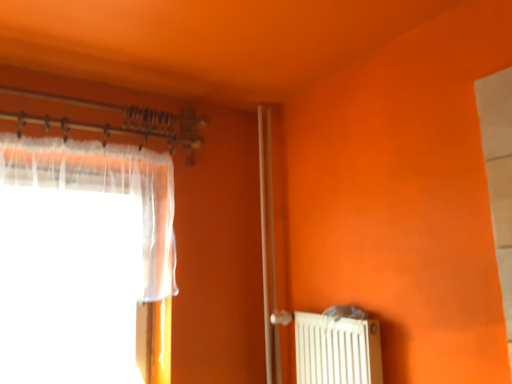
Question: Can you confirm if white matte radiator at lower right is positioned to the left of translucent fabric curtain at left?

Choices:
 (A) no
 (B) yes

Answer: (A)

Question: From a real-world perspective, is white matte radiator at lower right on top of translucent fabric curtain at left?

Choices:
 (A) yes
 (B) no

Answer: (B)

Question: From the image's perspective, does white matte radiator at lower right appear lower than translucent fabric curtain at left?

Choices:
 (A) no
 (B) yes

Answer: (B)

Question: Considering the relative positions of white matte radiator at lower right and translucent fabric curtain at left in the image provided, is white matte radiator at lower right to the right of translucent fabric curtain at left from the viewer's perspective?

Choices:
 (A) yes
 (B) no

Answer: (A)

Question: From a real-world perspective, is white matte radiator at lower right under translucent fabric curtain at left?

Choices:
 (A) no
 (B) yes

Answer: (B)

Question: Considering the relative sizes of white matte radiator at lower right and translucent fabric curtain at left in the image provided, is white matte radiator at lower right wider than translucent fabric curtain at left?

Choices:
 (A) yes
 (B) no

Answer: (B)

Question: Considering the relative positions of clear glass screen door at center and translucent fabric curtain at left in the image provided, is clear glass screen door at center to the right of translucent fabric curtain at left from the viewer's perspective?

Choices:
 (A) yes
 (B) no

Answer: (A)

Question: Can you confirm if clear glass screen door at center is positioned to the left of translucent fabric curtain at left?

Choices:
 (A) yes
 (B) no

Answer: (B)

Question: Is clear glass screen door at center not near translucent fabric curtain at left?

Choices:
 (A) yes
 (B) no

Answer: (B)

Question: Considering the relative positions of clear glass screen door at center and translucent fabric curtain at left in the image provided, is clear glass screen door at center in front of translucent fabric curtain at left?

Choices:
 (A) yes
 (B) no

Answer: (B)

Question: Does clear glass screen door at center have a greater height compared to translucent fabric curtain at left?

Choices:
 (A) yes
 (B) no

Answer: (A)

Question: Can you confirm if clear glass screen door at center is wider than translucent fabric curtain at left?

Choices:
 (A) yes
 (B) no

Answer: (B)

Question: Does translucent fabric curtain at left have a smaller size compared to white matte radiator at lower right?

Choices:
 (A) no
 (B) yes

Answer: (A)